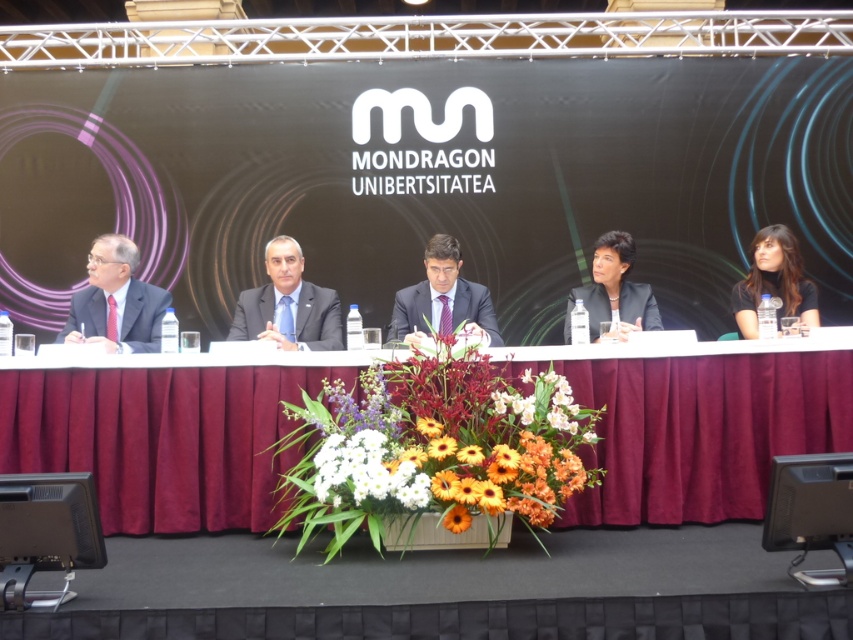
Question: Can you confirm if matte black suit at left is positioned to the right of black matte business suit at right?

Choices:
 (A) yes
 (B) no

Answer: (B)

Question: Which of these objects is positioned farthest from the black matte business suit at right?

Choices:
 (A) maroon fabric table at center
 (B) black fabric at upper center

Answer: (B)

Question: Which object is the farthest from the black fabric at upper center?

Choices:
 (A) dark brown hair at upper right
 (B) black matte blazer at center

Answer: (A)

Question: Does black fabric at upper center have a smaller size compared to floral bouquet at center?

Choices:
 (A) yes
 (B) no

Answer: (A)

Question: Is floral bouquet at center positioned behind dark brown hair at upper right?

Choices:
 (A) no
 (B) yes

Answer: (A)

Question: Which of the following is the closest to the observer?

Choices:
 (A) matte black suit at left
 (B) black matte blazer at center

Answer: (A)